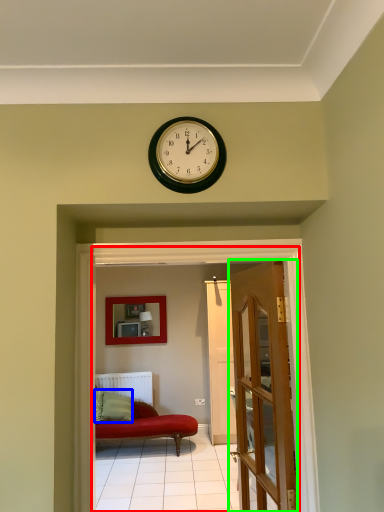
Question: Considering the real-world distances, which object is closest to corridor (highlighted by a red box)? pillow (highlighted by a blue box) or door (highlighted by a green box).

Choices:
 (A) pillow
 (B) door

Answer: (B)